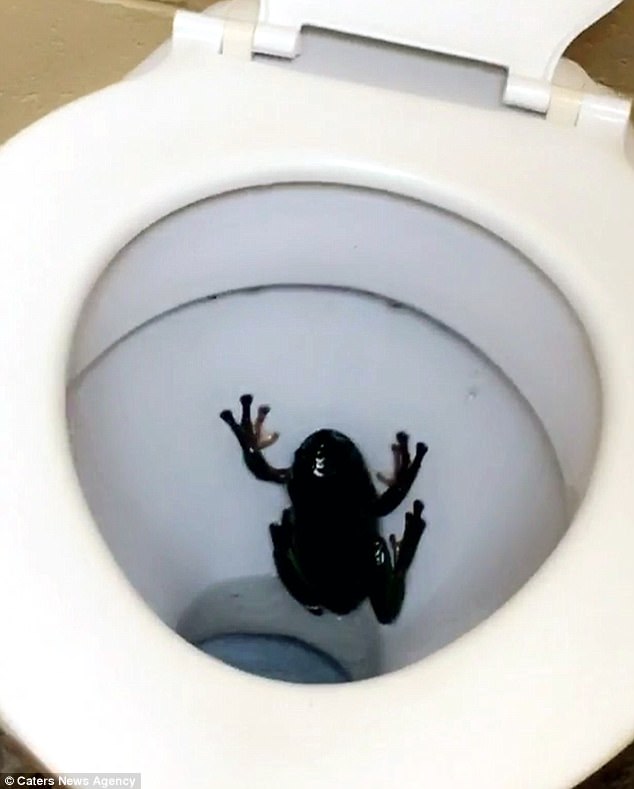
The image size is (634, 789). Find the location of `wall`. wall is located at coordinates (87, 28), (605, 39).